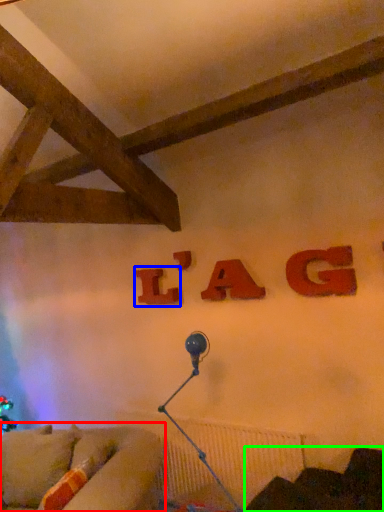
Question: Which is nearer to the studio couch (highlighted by a red box)? alphabet (highlighted by a blue box) or furniture (highlighted by a green box).

Choices:
 (A) alphabet
 (B) furniture

Answer: (B)